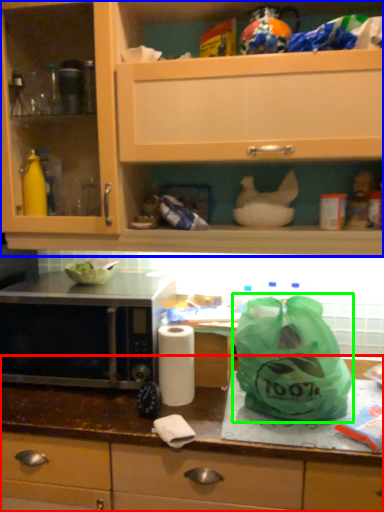
Question: Which object is the closest to the countertop (highlighted by a red box)? Choose among these: cabinetry (highlighted by a blue box) or plastic bag (highlighted by a green box).

Choices:
 (A) cabinetry
 (B) plastic bag

Answer: (B)